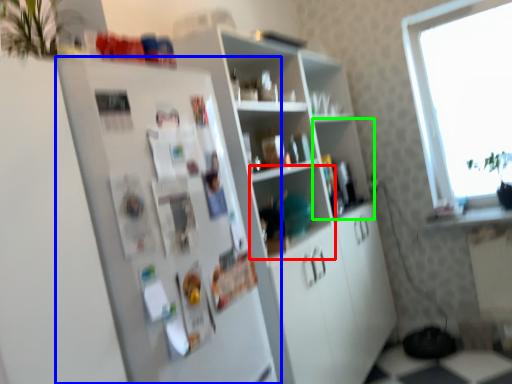
Question: Based on their relative distances, which object is nearer to shelf (highlighted by a red box)? Choose from fridge (highlighted by a blue box) and shelf (highlighted by a green box).

Choices:
 (A) fridge
 (B) shelf

Answer: (B)